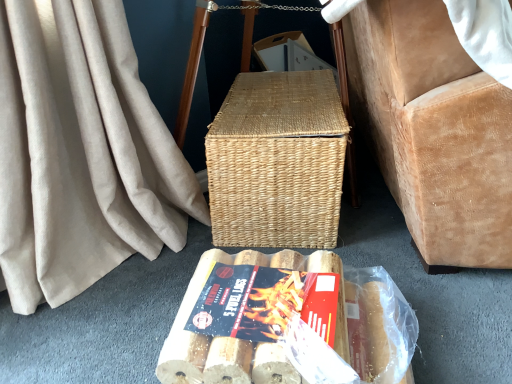
Question: Is wooden textured logs at center to the right of wooden logs at lower center from the viewer's perspective?

Choices:
 (A) no
 (B) yes

Answer: (A)

Question: Would you say wooden logs at lower center is part of wooden textured logs at center's contents?

Choices:
 (A) yes
 (B) no

Answer: (B)

Question: From a real-world perspective, is wooden textured logs at center beneath wooden logs at lower center?

Choices:
 (A) yes
 (B) no

Answer: (B)

Question: From a real-world perspective, is wooden textured logs at center on wooden logs at lower center?

Choices:
 (A) no
 (B) yes

Answer: (B)

Question: Is wooden textured logs at center closer to the viewer compared to wooden logs at lower center?

Choices:
 (A) yes
 (B) no

Answer: (B)

Question: Relative to woven natural picnic basket at center, is suede armchair at right in front or behind?

Choices:
 (A) front
 (B) behind

Answer: (A)

Question: Considering the positions of suede armchair at right and woven natural picnic basket at center in the image, is suede armchair at right wider or thinner than woven natural picnic basket at center?

Choices:
 (A) thin
 (B) wide

Answer: (B)

Question: Is suede armchair at right inside the boundaries of woven natural picnic basket at center, or outside?

Choices:
 (A) outside
 (B) inside

Answer: (A)

Question: Looking at the image, does suede armchair at right seem bigger or smaller compared to woven natural picnic basket at center?

Choices:
 (A) big
 (B) small

Answer: (A)

Question: Is wooden logs at lower center to the left or to the right of woven natural picnic basket at center in the image?

Choices:
 (A) left
 (B) right

Answer: (A)

Question: Is wooden logs at lower center spatially inside woven natural picnic basket at center, or outside of it?

Choices:
 (A) inside
 (B) outside

Answer: (B)

Question: Is wooden logs at lower center in front of or behind woven natural picnic basket at center in the image?

Choices:
 (A) behind
 (B) front

Answer: (B)

Question: Looking at their shapes, would you say wooden logs at lower center is wider or thinner than woven natural picnic basket at center?

Choices:
 (A) thin
 (B) wide

Answer: (B)

Question: Looking at the image, does wooden textured logs at center seem bigger or smaller compared to wooden logs at lower center?

Choices:
 (A) big
 (B) small

Answer: (B)

Question: From their relative heights in the image, would you say wooden textured logs at center is taller or shorter than wooden logs at lower center?

Choices:
 (A) short
 (B) tall

Answer: (A)